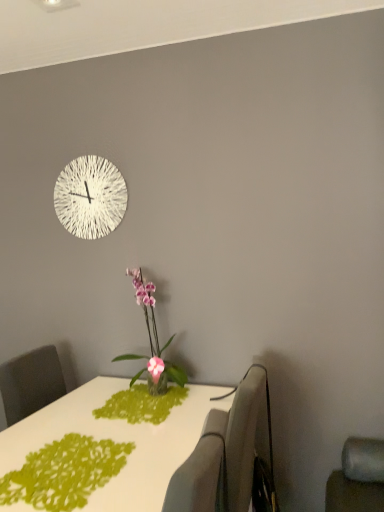
What is the approximate height of green paper doily at lower left?

It is 0.88 inches.

Where is `white glossy table at center`? This screenshot has height=512, width=384. white glossy table at center is located at coordinates (117, 441).

Locate an element on the screen. Image resolution: width=384 pixels, height=512 pixels. gray fabric swivel chair at right, placed as the 1th swivel chair when sorted from back to front is located at coordinates (269, 439).

What do you see at coordinates (202, 471) in the screenshot? I see `fabric swivel chair at lower center, which ranks as the 2th swivel chair in back-to-front order` at bounding box center [202, 471].

Where is `white textured clock at upper center`? white textured clock at upper center is located at coordinates (90, 197).

Measure the distance between white glossy table at center and fabric swivel chair at lower center, marked as the first swivel chair in a front-to-back arrangement.

They are 16.81 inches apart.

From the image's perspective, relative to fabric swivel chair at lower center, marked as the first swivel chair in a front-to-back arrangement, is white glossy table at center above or below?

From the image's perspective, white glossy table at center appears below fabric swivel chair at lower center, marked as the first swivel chair in a front-to-back arrangement.

Is white glossy table at center placed right next to fabric swivel chair at lower center, marked as the first swivel chair in a front-to-back arrangement?

They are not placed beside each other.

The width and height of the screenshot is (384, 512). Identify the location of table below the fabric swivel chair at lower center, which ranks as the 2th swivel chair in back-to-front order (from a real-world perspective). (117, 441).

From a real-world perspective, is green paper doily at lower left over white glossy table at center?

Yes.

Is green paper doily at lower left facing towards white glossy table at center?

Yes.

From the image's perspective, is green paper doily at lower left located above white glossy table at center?

Indeed, from the image's perspective, green paper doily at lower left is shown above white glossy table at center.

Does green paper doily at lower left have a greater width compared to white glossy table at center?

No.

In the image, is white textured clock at upper center positioned in front of or behind fabric swivel chair at lower center, which ranks as the 2th swivel chair in back-to-front order?

white textured clock at upper center is behind fabric swivel chair at lower center, which ranks as the 2th swivel chair in back-to-front order.

Is white textured clock at upper center outside of fabric swivel chair at lower center, marked as the first swivel chair in a front-to-back arrangement?

Absolutely, white textured clock at upper center is external to fabric swivel chair at lower center, marked as the first swivel chair in a front-to-back arrangement.

Considering the sizes of objects white textured clock at upper center and fabric swivel chair at lower center, which ranks as the 2th swivel chair in back-to-front order, in the image provided, who is wider, white textured clock at upper center or fabric swivel chair at lower center, which ranks as the 2th swivel chair in back-to-front order,?

fabric swivel chair at lower center, which ranks as the 2th swivel chair in back-to-front order.

From a real-world perspective, which object stands above the other?

In real-world perspective, white textured clock at upper center is above.

Considering the positions of objects green paper doily at lower left and white textured clock at upper center in the image provided, who is behind, green paper doily at lower left or white textured clock at upper center?

white textured clock at upper center.

Who is smaller, green paper doily at lower left or white textured clock at upper center?

With smaller size is green paper doily at lower left.

Is green paper doily at lower left in contact with white textured clock at upper center?

green paper doily at lower left is not next to white textured clock at upper center, and they're not touching.

Between green paper doily at lower left and white textured clock at upper center, which one has less height?

green paper doily at lower left.

From the image's perspective, is green paper doily at lower left under pink glossy orchid at center?

Yes, from the image's perspective, green paper doily at lower left is beneath pink glossy orchid at center.

In the scene shown: How different are the orientations of green paper doily at lower left and pink glossy orchid at center in degrees?

green paper doily at lower left and pink glossy orchid at center are facing 0.000253 degrees away from each other.

Based on the photo, are green paper doily at lower left and pink glossy orchid at center located far from each other?

Actually, green paper doily at lower left and pink glossy orchid at center are a little close together.

Can you confirm if green paper doily at lower left is positioned to the left of pink glossy orchid at center?

Correct, you'll find green paper doily at lower left to the left of pink glossy orchid at center.

Where is `table beneath the green paper doily at lower left (from a real-world perspective)`? The height and width of the screenshot is (512, 384). table beneath the green paper doily at lower left (from a real-world perspective) is located at coordinates (117, 441).

Does white glossy table at center have a greater width compared to green paper doily at lower left?

Yes, white glossy table at center is wider than green paper doily at lower left.

Which is in front, white glossy table at center or green paper doily at lower left?

white glossy table at center is closer to the camera.

From a real-world perspective, is white glossy table at center located higher than green paper doily at lower left?

No, from a real-world perspective, white glossy table at center is not on top of green paper doily at lower left.

Considering the relative sizes of white glossy table at center and pink glossy orchid at center in the image provided, is white glossy table at center taller than pink glossy orchid at center?

Indeed, white glossy table at center has a greater height compared to pink glossy orchid at center.

Image resolution: width=384 pixels, height=512 pixels. I want to click on houseplant above the white glossy table at center (from a real-world perspective), so click(x=152, y=343).

From a real-world perspective, is white glossy table at center positioned above or below pink glossy orchid at center?

white glossy table at center is below pink glossy orchid at center.

Locate an element on the screen. The image size is (384, 512). swivel chair that is the 2nd object above the white glossy table at center (from a real-world perspective) is located at coordinates (202, 471).

You are a GUI agent. You are given a task and a screenshot of the screen. Output one action in this format:
    pyautogui.click(x=<x>, y=<y>)
    Task: Click on the table below the green paper doily at lower left (from the image's perspective)
    
    Given the screenshot: What is the action you would take?
    pyautogui.click(x=117, y=441)

Which object lies nearer to the anchor point fabric swivel chair at lower center, which ranks as the 2th swivel chair in back-to-front order, white textured clock at upper center or pink glossy orchid at center?

pink glossy orchid at center.

When comparing their distances from gray fabric swivel chair at right, acting as the second swivel chair starting from the front, does green paper doily at lower left or pink glossy orchid at center seem closer?

Result: The object closer to gray fabric swivel chair at right, acting as the second swivel chair starting from the front, is pink glossy orchid at center.

Based on the photo, from the image, which object appears to be farther from gray fabric swivel chair at right, placed as the 1th swivel chair when sorted from back to front, white textured clock at upper center or pink glossy orchid at center?

white textured clock at upper center.

Considering their positions, is green paper doily at lower left positioned closer to fabric swivel chair at lower center, which ranks as the 2th swivel chair in back-to-front order, than pink glossy orchid at center?

Among the two, green paper doily at lower left is located nearer to fabric swivel chair at lower center, which ranks as the 2th swivel chair in back-to-front order.

Based on their spatial positions, is fabric swivel chair at lower center, which ranks as the 2th swivel chair in back-to-front order, or gray fabric swivel chair at right, acting as the second swivel chair starting from the front, further from pink glossy orchid at center?

The object further to pink glossy orchid at center is fabric swivel chair at lower center, which ranks as the 2th swivel chair in back-to-front order.

Considering their positions, is fabric swivel chair at lower center, marked as the first swivel chair in a front-to-back arrangement, positioned further to pink glossy orchid at center than green paper doily at lower left?

Based on the image, fabric swivel chair at lower center, marked as the first swivel chair in a front-to-back arrangement, appears to be further to pink glossy orchid at center.

From the image, which object appears to be nearer to white glossy table at center, white textured clock at upper center or pink glossy orchid at center?

The object closer to white glossy table at center is pink glossy orchid at center.

From the image, which object appears to be farther from white glossy table at center, gray fabric swivel chair at right, placed as the 1th swivel chair when sorted from back to front, or fabric swivel chair at lower center, which ranks as the 2th swivel chair in back-to-front order?

Among the two, gray fabric swivel chair at right, placed as the 1th swivel chair when sorted from back to front, is located further to white glossy table at center.

This screenshot has height=512, width=384. Identify the location of design between fabric swivel chair at lower center, marked as the first swivel chair in a front-to-back arrangement, and white textured clock at upper center from front to back. (64, 473).

Locate an element on the screen. The height and width of the screenshot is (512, 384). swivel chair positioned between white glossy table at center and pink glossy orchid at center from near to far is located at coordinates (269, 439).

This screenshot has width=384, height=512. What are the coordinates of `design between fabric swivel chair at lower center, which ranks as the 2th swivel chair in back-to-front order, and gray fabric swivel chair at right, placed as the 1th swivel chair when sorted from back to front, in the front-back direction` in the screenshot? It's located at (64, 473).

Identify the location of swivel chair between fabric swivel chair at lower center, marked as the first swivel chair in a front-to-back arrangement, and white textured clock at upper center in the front-back direction. (269, 439).